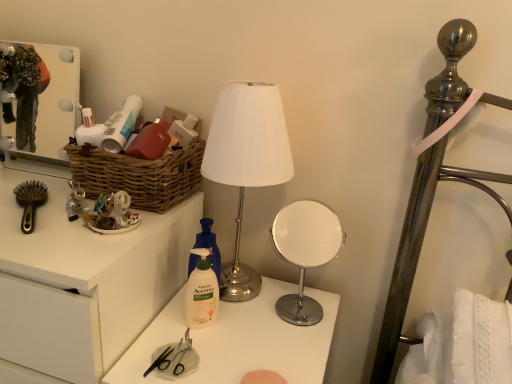
In order to click on vacant space to the right of brown plastic brush at left in this screenshot , I will do `click(80, 228)`.